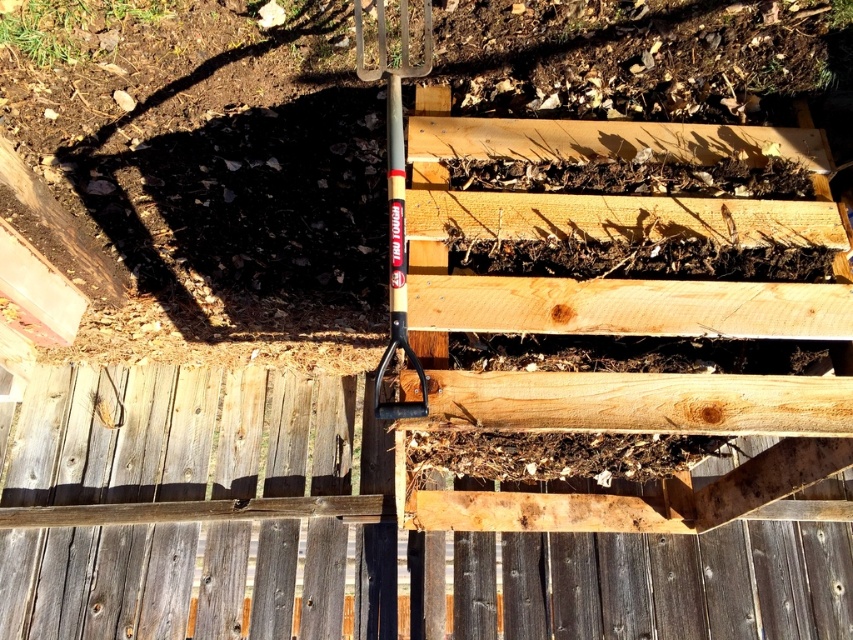
You are a gardener who needs to move the wooden handle shovel at center to access the garden fork behind the weathered wood fence at center. Can you move the shovel to the left to reach the fork?

The weathered wood fence at center is positioned on the right side of wooden handle shovel at center, so moving the shovel to the left would allow you to access the garden fork behind the weathered wood fence at center.

You are a gardener working on a deck under construction. You notice two tools lying on the deck surface near the center. One is a weathered wood fence at center and the other is a wooden handle shovel at center. Which tool is positioned lower on the deck surface?

The weathered wood fence at center is below the wooden handle shovel at center, so the weathered wood fence at center is positioned lower on the deck surface.

You are a gardener who needs to determine which object is shorter between the weathered wood fence at center and the wooden handle shovel at center. Based on the scene, which one is shorter?

The weathered wood fence at center is shorter than the wooden handle shovel at center according to the description.